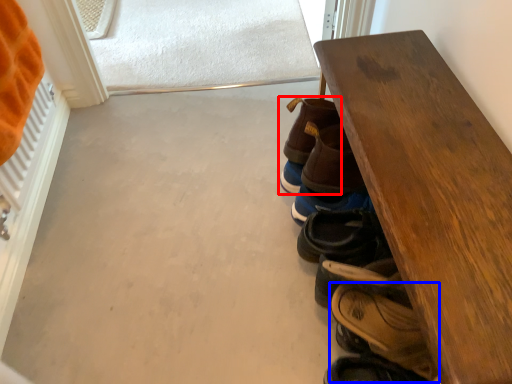
Question: Which point is further to the camera, footwear (highlighted by a red box) or footwear (highlighted by a blue box)?

Choices:
 (A) footwear
 (B) footwear

Answer: (A)